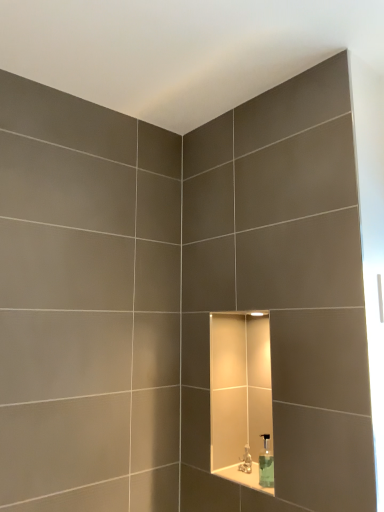
Question: Is translucent plastic faucet at center taller or shorter than white glossy ledge at center?

Choices:
 (A) tall
 (B) short

Answer: (A)

Question: From the image's perspective, relative to white glossy ledge at center, is translucent plastic faucet at center above or below?

Choices:
 (A) above
 (B) below

Answer: (A)

Question: Estimate the real-world distances between objects in this image. Which object is farther from the translucent plastic faucet at center?

Choices:
 (A) white glossy ledge at center
 (B) clear glass soap dispenser at center

Answer: (B)

Question: Which of these objects is positioned farthest from the white glossy ledge at center?

Choices:
 (A) clear glass soap dispenser at center
 (B) translucent plastic faucet at center

Answer: (A)